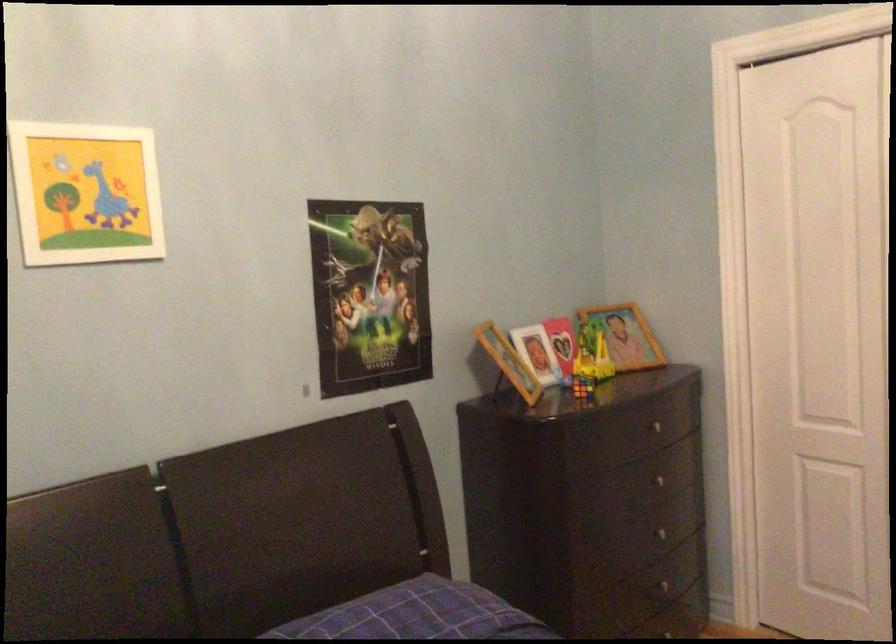
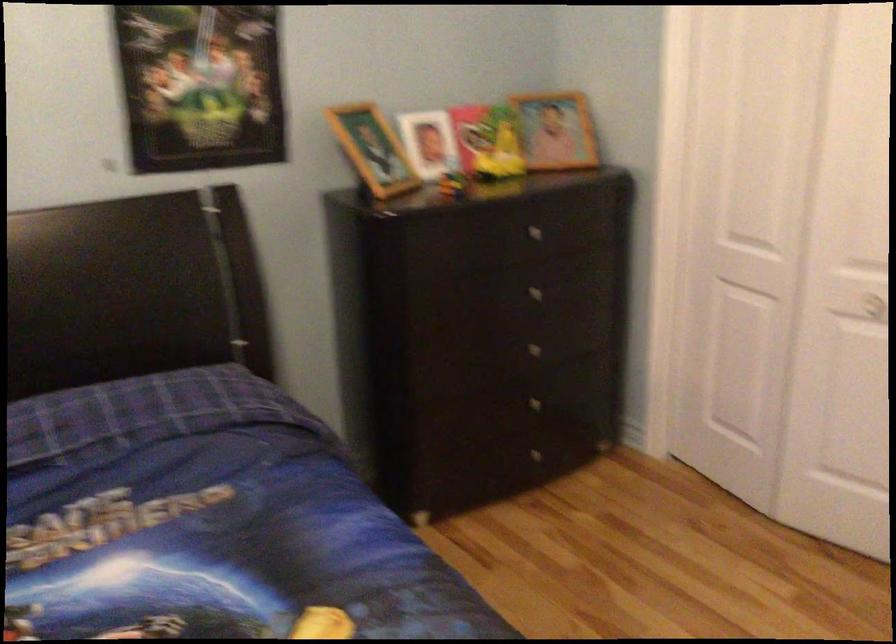
Locate, in the second image, the point that corresponds to point (591, 352) in the first image.

(487, 142)